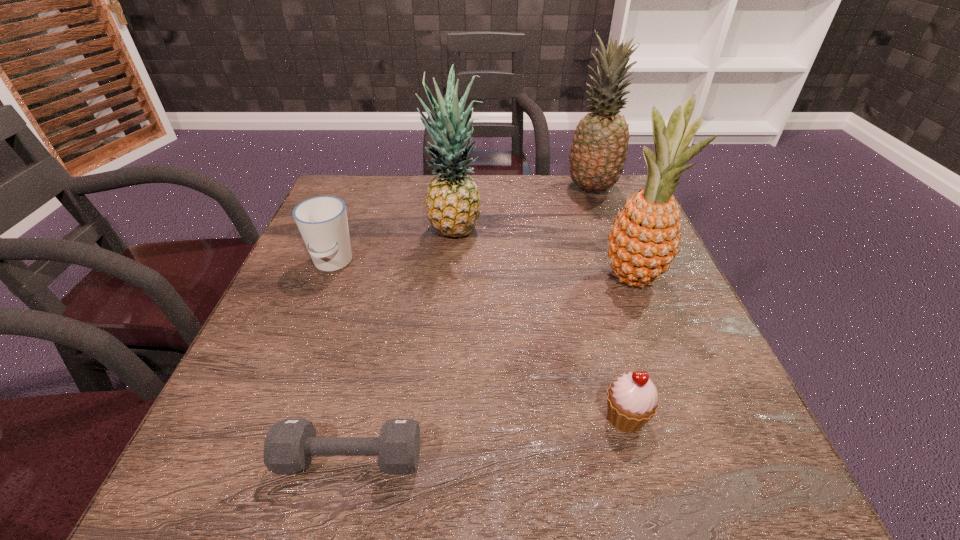
At what (x,y) coordinates should I click in order to perform the action: click on free point between the fourth tallest object and the cupcake. Please return your answer as a coordinate pair (x, y). Looking at the image, I should click on (479, 340).

Select which object is the second closest to the third shortest object. Please provide its 2D coordinates. Your answer should be formatted as a tuple, i.e. [(x, y)], where the tuple contains the x and y coordinates of a point satisfying the conditions above.

[(290, 444)]

You are a GUI agent. You are given a task and a screenshot of the screen. Output one action in this format:
    pyautogui.click(x=<x>, y=<y>)
    Task: Click on the object that ranks as the fourth closest to the shortest object
    
    Given the screenshot: What is the action you would take?
    pyautogui.click(x=453, y=207)

Identify which pineapple is the second nearest to the second farthest pineapple. Please provide its 2D coordinates. Your answer should be formatted as a tuple, i.e. [(x, y)], where the tuple contains the x and y coordinates of a point satisfying the conditions above.

[(645, 238)]

I want to click on the closest pineapple to the dumbbell, so click(645, 238).

At what (x,y) coordinates should I click in order to perform the action: click on vacant region that satisfies the following two spatial constraints: 1. with a handle on the side of the third shortest object; 2. on the right side of the fifth tallest object. Please return your answer as a coordinate pair (x, y). Looking at the image, I should click on (271, 417).

Identify the location of free location that satisfies the following two spatial constraints: 1. with a handle on the side of the fourth tallest object; 2. on the right side of the shortest object. Image resolution: width=960 pixels, height=540 pixels. (255, 457).

Identify the location of free space that satisfies the following two spatial constraints: 1. with a handle on the side of the nearest pineapple; 2. on the left side of the cup. The height and width of the screenshot is (540, 960). (326, 278).

You are a GUI agent. You are given a task and a screenshot of the screen. Output one action in this format:
    pyautogui.click(x=<x>, y=<y>)
    Task: Click on the free space that satisfies the following two spatial constraints: 1. with a handle on the side of the nearest pineapple; 2. on the left side of the cup
    The height and width of the screenshot is (540, 960).
    Given the screenshot: What is the action you would take?
    pyautogui.click(x=326, y=278)

The height and width of the screenshot is (540, 960). I want to click on vacant space that satisfies the following two spatial constraints: 1. with a handle on the side of the cup; 2. on the left side of the cupcake, so click(x=271, y=417).